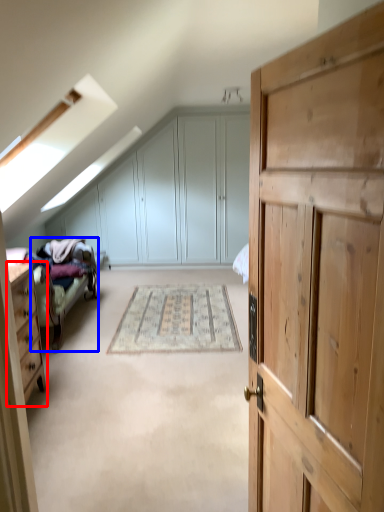
Question: Which of the following is the closest to the observer, chest of drawers (highlighted by a red box) or bed frame (highlighted by a blue box)?

Choices:
 (A) chest of drawers
 (B) bed frame

Answer: (A)